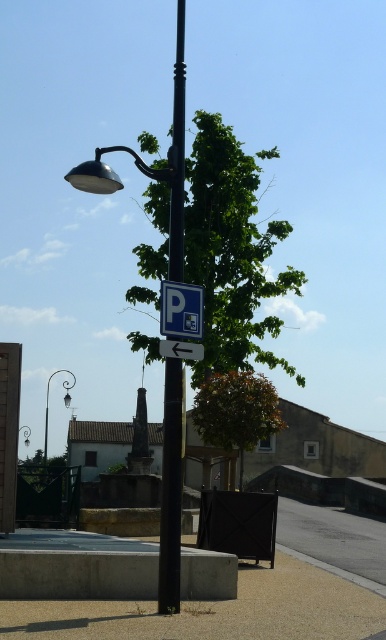
The height and width of the screenshot is (640, 386). Describe the element at coordinates (170, 492) in the screenshot. I see `metallic pole at center` at that location.

Which is above, metallic pole at center or green leafy tree at center?

metallic pole at center is above.

You are a GUI agent. You are given a task and a screenshot of the screen. Output one action in this format:
    pyautogui.click(x=<x>, y=<y>)
    Task: Click on the metallic pole at center
    Image resolution: width=386 pixels, height=640 pixels.
    Given the screenshot: What is the action you would take?
    tap(170, 492)

This screenshot has width=386, height=640. Find the location of `metallic pole at center`. metallic pole at center is located at coordinates (170, 492).

Does smooth concrete pavement at lower center come behind green leafy tree at center?

No.

Is point (247, 602) farther from camera compared to point (218, 403)?

No, it is not.

The width and height of the screenshot is (386, 640). What do you see at coordinates (211, 608) in the screenshot?
I see `smooth concrete pavement at lower center` at bounding box center [211, 608].

Image resolution: width=386 pixels, height=640 pixels. Identify the location of smooth concrete pavement at lower center. (211, 608).

Does green leafy tree at center have a greater width compared to metallic street light at upper left?

Incorrect, green leafy tree at center's width does not surpass metallic street light at upper left's.

Between green leafy tree at center and metallic street light at upper left, which one appears on the right side from the viewer's perspective?

green leafy tree at center

Identify the location of green leafy tree at center. (235, 412).